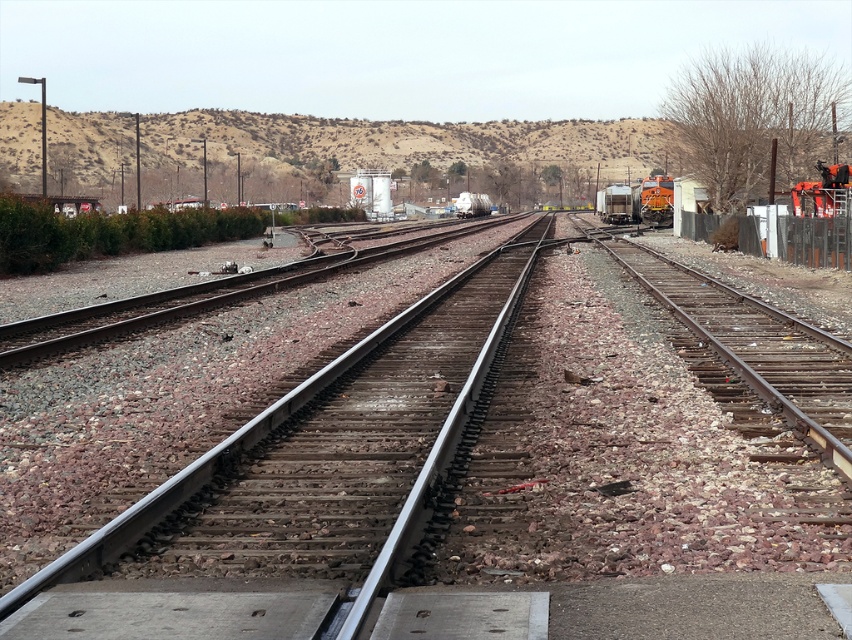
Question: Is metal fence at right to the right of orange metallic train at right from the viewer's perspective?

Choices:
 (A) yes
 (B) no

Answer: (B)

Question: Which object appears closest to the camera in this image?

Choices:
 (A) metal/smooth train track at center
 (B) metal fence at right

Answer: (A)

Question: Which object is farther from the camera taking this photo?

Choices:
 (A) metal fence at right
 (B) orange metallic train at right

Answer: (B)

Question: From the image, what is the correct spatial relationship of metal/smooth train track at center in relation to orange metallic train at right?

Choices:
 (A) above
 (B) below

Answer: (B)

Question: Is metal fence at right to the right of orange metallic train at right from the viewer's perspective?

Choices:
 (A) no
 (B) yes

Answer: (A)

Question: Estimate the real-world distances between objects in this image. Which object is closer to the metal fence at right?

Choices:
 (A) orange metallic train at right
 (B) metal/smooth train track at center

Answer: (B)